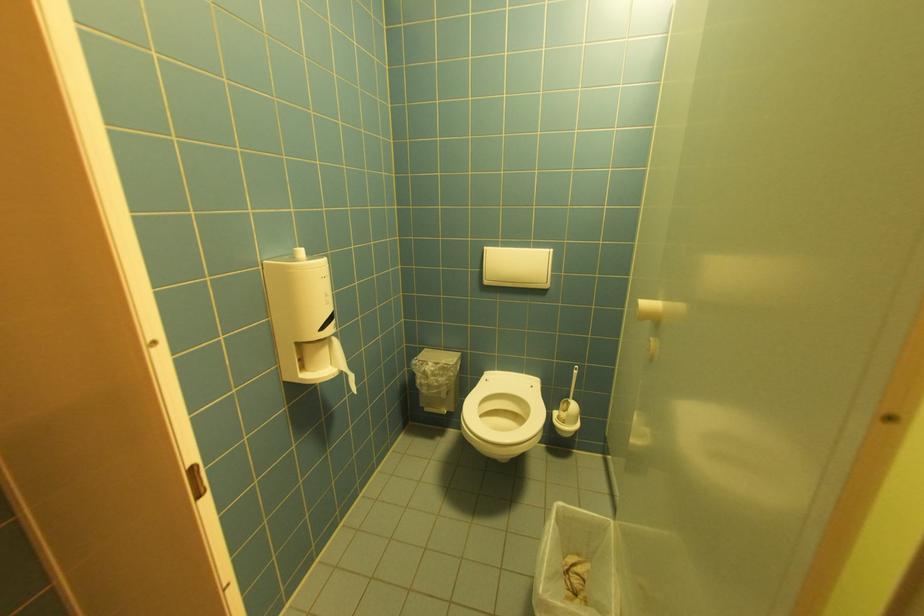
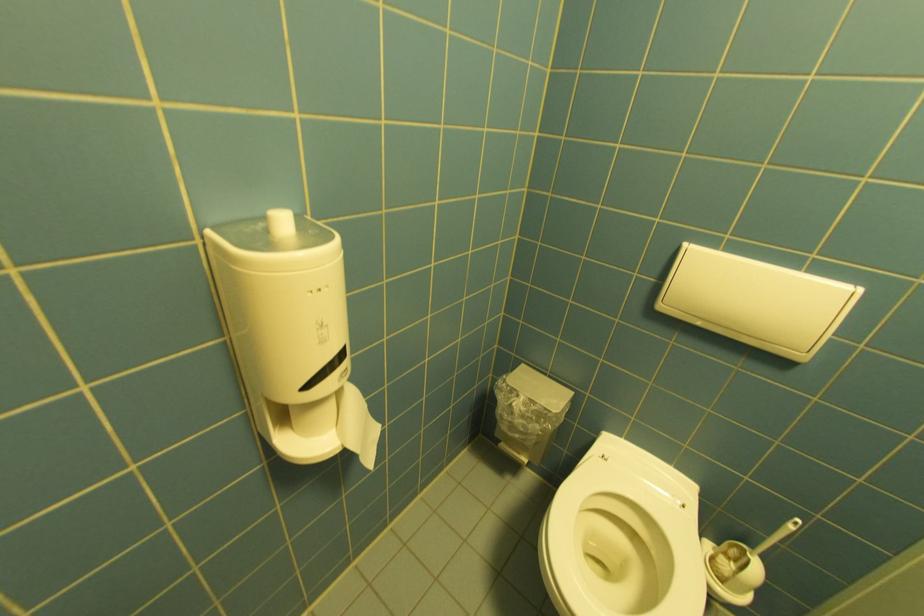
Question: The camera is either moving clockwise (left) or counter-clockwise (right) around the object. The first image is from the beginning of the video and the second image is from the end. Is the camera moving left or right when shooting the video?

Choices:
 (A) Left
 (B) Right

Answer: (B)